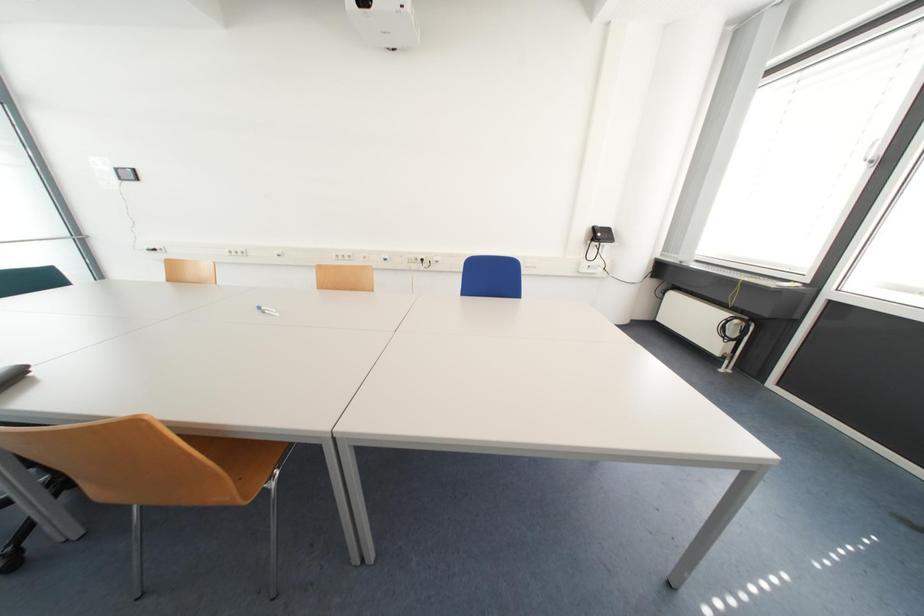
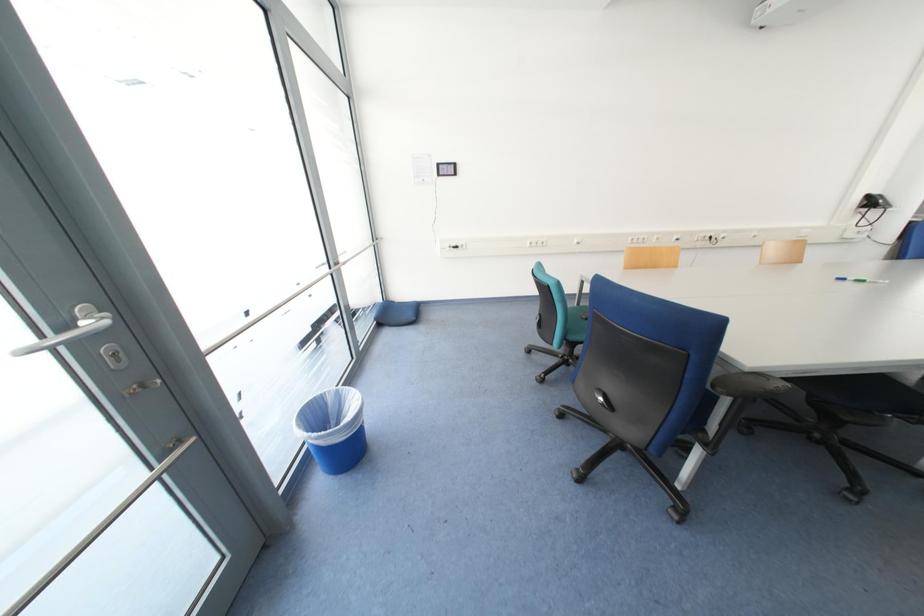
Question: In a continuous first-person perspective shot, in which direction is the camera moving?

Choices:
 (A) Left
 (B) Right
 (C) Forward
 (D) Backward

Answer: (A)